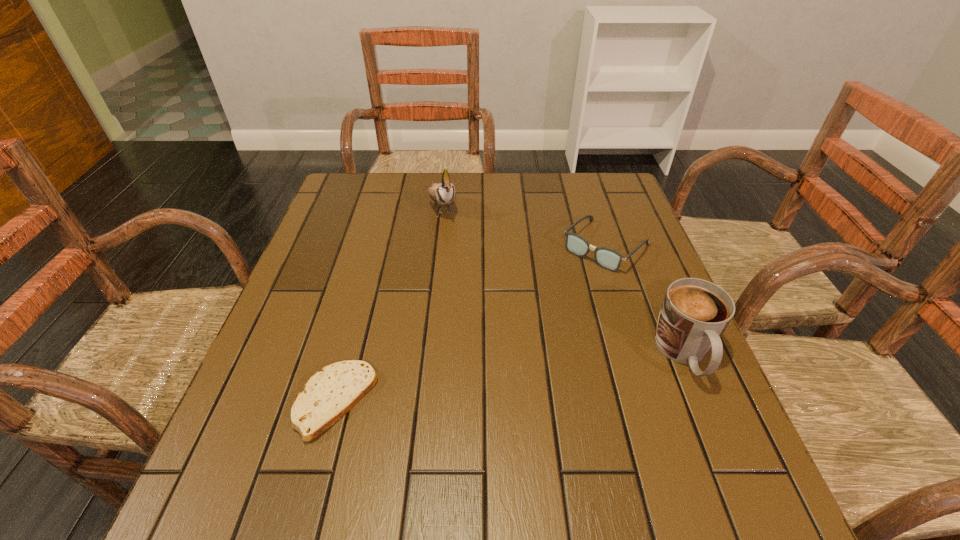
The width and height of the screenshot is (960, 540). What are the coordinates of `free space that is in between the pita bread and the spectacles` in the screenshot? It's located at (470, 323).

Locate an element on the screen. free space between the second tallest object and the second shortest object is located at coordinates (645, 300).

Where is `vacant area that lies between the third object from right to left and the third tallest object`? vacant area that lies between the third object from right to left and the third tallest object is located at coordinates (524, 225).

Find the location of a particular element. The width and height of the screenshot is (960, 540). free space between the third shortest object and the bird is located at coordinates (564, 280).

Find the location of a particular element. The width and height of the screenshot is (960, 540). vacant point located between the second object from left to right and the third tallest object is located at coordinates (524, 225).

Locate an element on the screen. vacant area between the bird and the mug is located at coordinates (564, 280).

Point out which object is positioned as the nearest to the spectacles. Please provide its 2D coordinates. Your answer should be formatted as a tuple, i.e. [(x, y)], where the tuple contains the x and y coordinates of a point satisfying the conditions above.

[(694, 314)]

At what (x,y) coordinates should I click in order to perform the action: click on object that ranks as the third closest to the pita bread. Please return your answer as a coordinate pair (x, y). The width and height of the screenshot is (960, 540). Looking at the image, I should click on (694, 314).

Locate an element on the screen. The image size is (960, 540). free space in the image that satisfies the following two spatial constraints: 1. on the back side of the third tallest object; 2. on the left side of the pita bread is located at coordinates point(377,246).